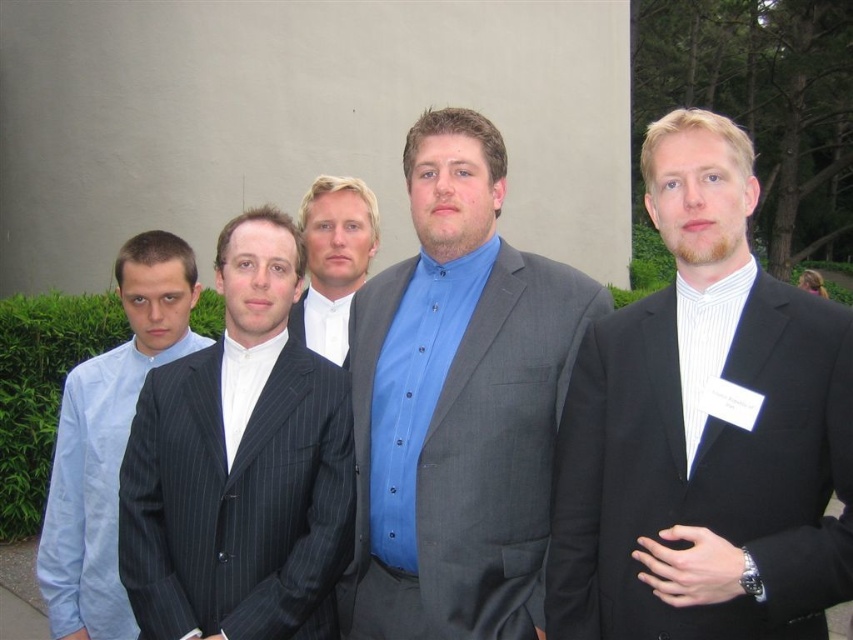
Does point (544, 579) lie in front of point (312, 276)?

Yes, it is in front of point (312, 276).

Between black pinstripe suit at right and white shirt at center, which one appears on the left side from the viewer's perspective?

white shirt at center

Image resolution: width=853 pixels, height=640 pixels. What do you see at coordinates (703, 429) in the screenshot?
I see `black pinstripe suit at right` at bounding box center [703, 429].

Locate an element on the screen. black pinstripe suit at right is located at coordinates (703, 429).

Looking at this image, can you confirm if matte blue shirt at center is thinner than dark gray pinstripe suit at center?

Incorrect, matte blue shirt at center's width is not less than dark gray pinstripe suit at center's.

Who is lower down, matte blue shirt at center or dark gray pinstripe suit at center?

Positioned lower is dark gray pinstripe suit at center.

What do you see at coordinates (457, 404) in the screenshot? Image resolution: width=853 pixels, height=640 pixels. I see `matte blue shirt at center` at bounding box center [457, 404].

Find the location of a particular element. matte blue shirt at center is located at coordinates (457, 404).

Who is higher up, black pinstripe suit at right or matte blue shirt at center?

black pinstripe suit at right is above.

Who is more distant from viewer, (653, 508) or (408, 529)?

The point (408, 529) is behind.

Where is `black pinstripe suit at right`? The image size is (853, 640). black pinstripe suit at right is located at coordinates (703, 429).